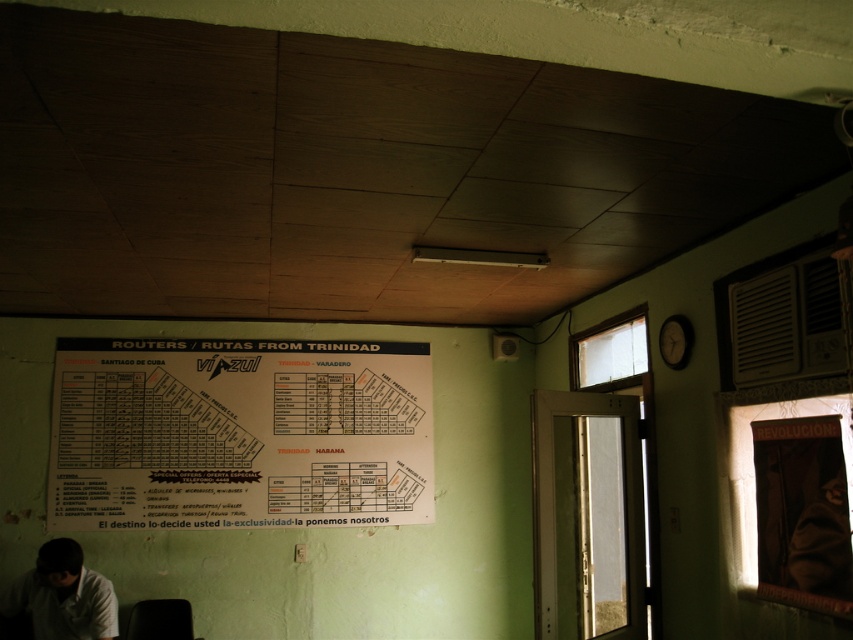
Is white paper poster at center taller than white matte shirt at lower left?

Yes, white paper poster at center is taller than white matte shirt at lower left.

Where is `white paper poster at center`? The height and width of the screenshot is (640, 853). white paper poster at center is located at coordinates (239, 433).